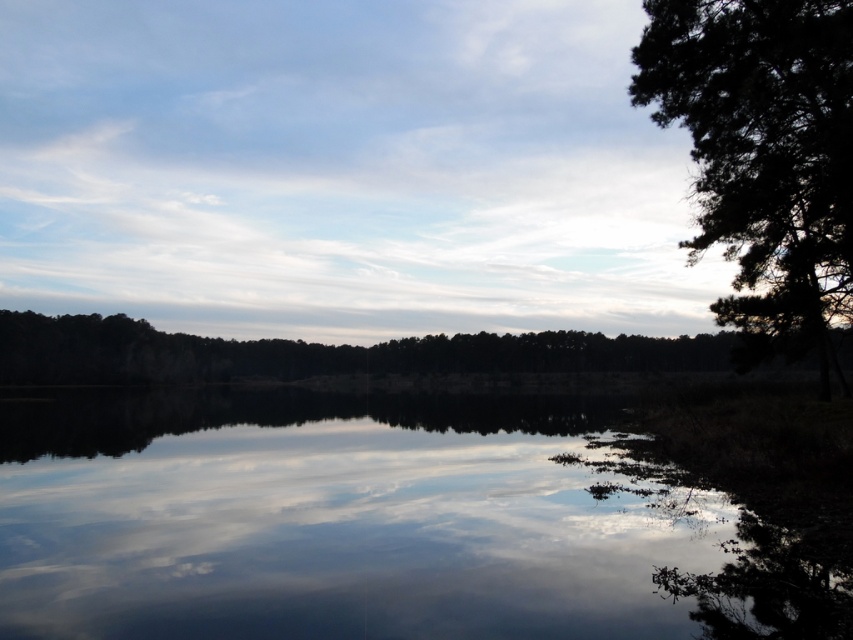
Is smooth reflective water at center to the right of dark green textured tree at right from the viewer's perspective?

Incorrect, smooth reflective water at center is not on the right side of dark green textured tree at right.

Who is taller, smooth reflective water at center or dark green textured tree at right?

With more height is dark green textured tree at right.

In order to click on smooth reflective water at center in this screenshot , I will do `click(375, 524)`.